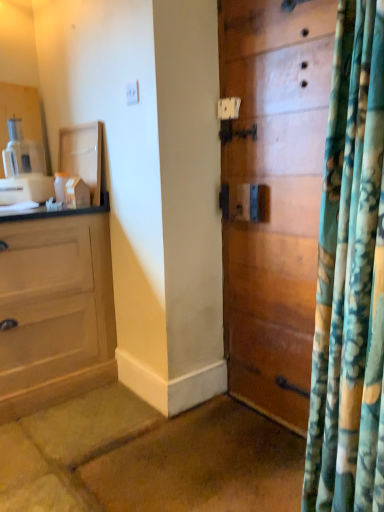
Question: Is wooden door at center to the left or to the right of white plastic coffee machine at left in the image?

Choices:
 (A) right
 (B) left

Answer: (A)

Question: From a real-world perspective, is wooden door at center above or below white plastic coffee machine at left?

Choices:
 (A) above
 (B) below

Answer: (B)

Question: From the image's perspective, is wooden door at center above or below white plastic coffee machine at left?

Choices:
 (A) above
 (B) below

Answer: (B)

Question: Considering the relative positions of white plastic coffee machine at left and wooden door at center in the image provided, is white plastic coffee machine at left to the left or to the right of wooden door at center?

Choices:
 (A) left
 (B) right

Answer: (A)

Question: Considering the positions of white plastic coffee machine at left and wooden door at center in the image, is white plastic coffee machine at left bigger or smaller than wooden door at center?

Choices:
 (A) small
 (B) big

Answer: (A)

Question: From a real-world perspective, relative to wooden door at center, is white plastic coffee machine at left vertically above or below?

Choices:
 (A) below
 (B) above

Answer: (B)

Question: Which is correct: white plastic coffee machine at left is inside wooden door at center, or outside of it?

Choices:
 (A) outside
 (B) inside

Answer: (A)